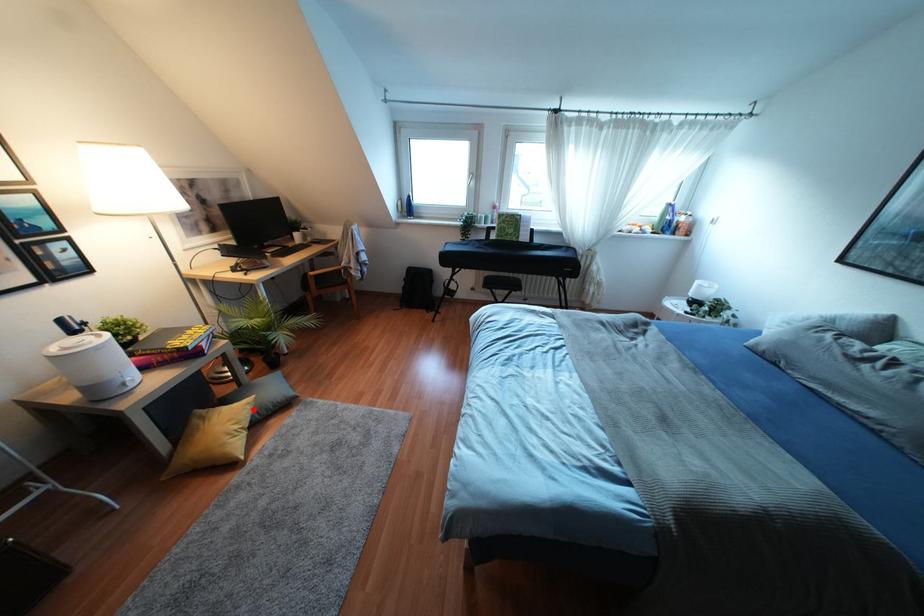
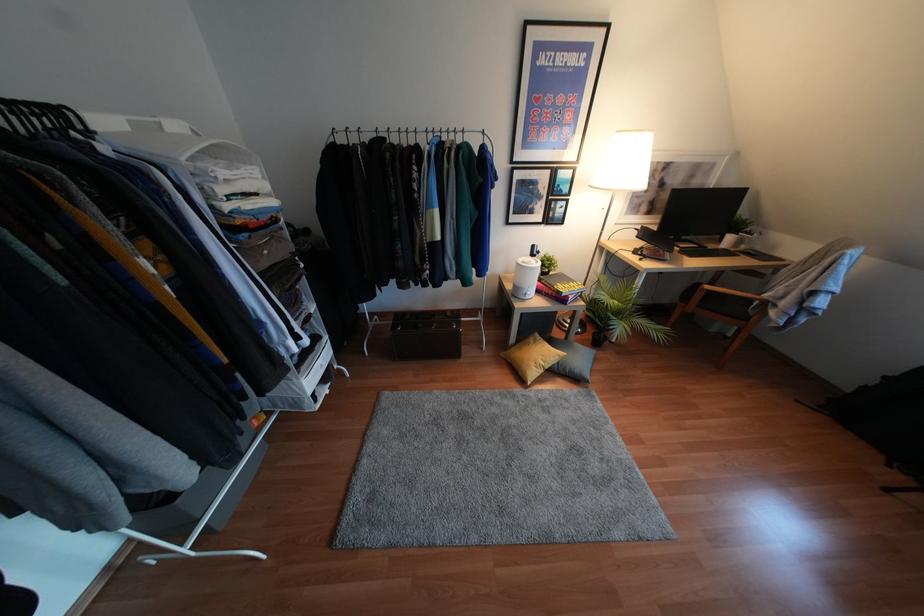
In the second image, find the point that corresponds to the highlighted location in the first image.

(556, 362)